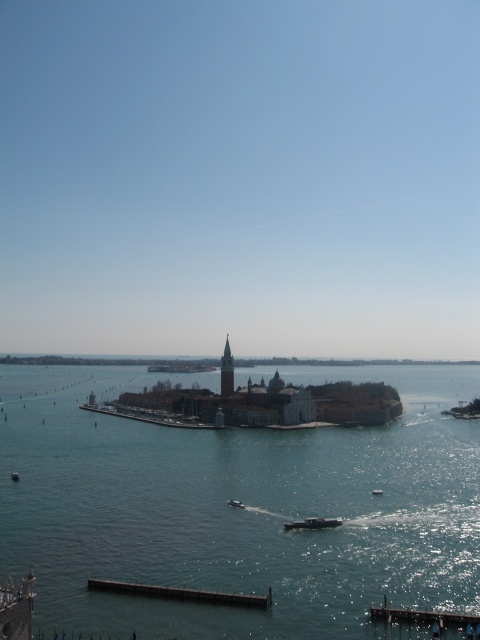
You are standing on the wooden planks at lower right and want to cross to the island. Can you see the clear blue water at center from your current position? Explain why based on their widths.

Yes, you can see the clear blue water at center from the wooden planks at lower right because the clear blue water at center is wider than the wooden planks at lower right, meaning it occupies more of the view.

You are standing on the island and want to locate two specific points marked on a map. The first point is at coordinates point [122,547] and the second is at point [373,492]. Based on the scene, which point is closer to you?

Point [122,547] is in front of point [373,492], so it is closer to you.

You are standing on the island and want to board the metallic gray boat at center. Which direction should you walk from the dark gray concrete dock at lower center to reach the boat?

You should walk to the right from the dark gray concrete dock at lower center since it is positioned on the left side of the metallic gray boat at center.